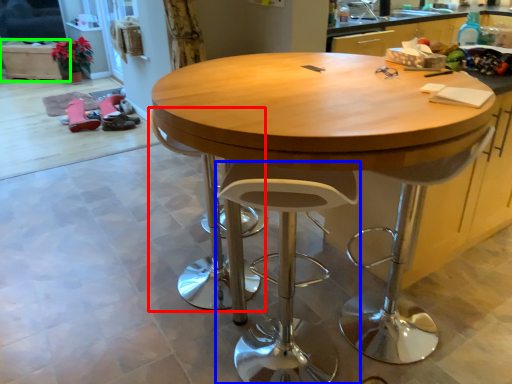
Question: Which is farther away from swivel chair (highlighted by a red box)? stool (highlighted by a blue box) or cabinetry (highlighted by a green box)?

Choices:
 (A) stool
 (B) cabinetry

Answer: (B)